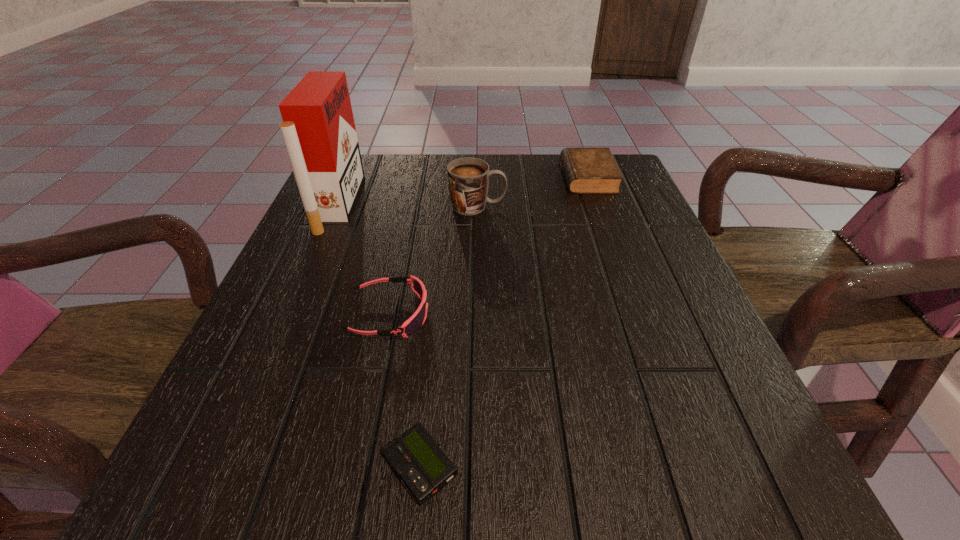
Identify the location of object situated at the far left corner. The width and height of the screenshot is (960, 540). (318, 129).

Where is `object that is at the far right corner`? The image size is (960, 540). object that is at the far right corner is located at coordinates (587, 170).

The height and width of the screenshot is (540, 960). I want to click on free space at the far edge of the desktop, so click(535, 181).

I want to click on vacant space at the near edge, so click(x=632, y=492).

The width and height of the screenshot is (960, 540). In order to click on free region at the left edge of the desktop in this screenshot , I will do pos(326,268).

Locate an element on the screen. Image resolution: width=960 pixels, height=540 pixels. vacant space at the right edge of the desktop is located at coordinates (649, 236).

The width and height of the screenshot is (960, 540). What are the coordinates of `vacant space at the far left corner of the desktop` in the screenshot? It's located at (372, 189).

Find the location of a particular element. free point at the near left corner is located at coordinates (270, 471).

The height and width of the screenshot is (540, 960). I want to click on free space between the beeper and the leftmost object, so click(379, 335).

Image resolution: width=960 pixels, height=540 pixels. Find the location of `empty space that is in between the second tallest object and the diary`. empty space that is in between the second tallest object and the diary is located at coordinates (533, 192).